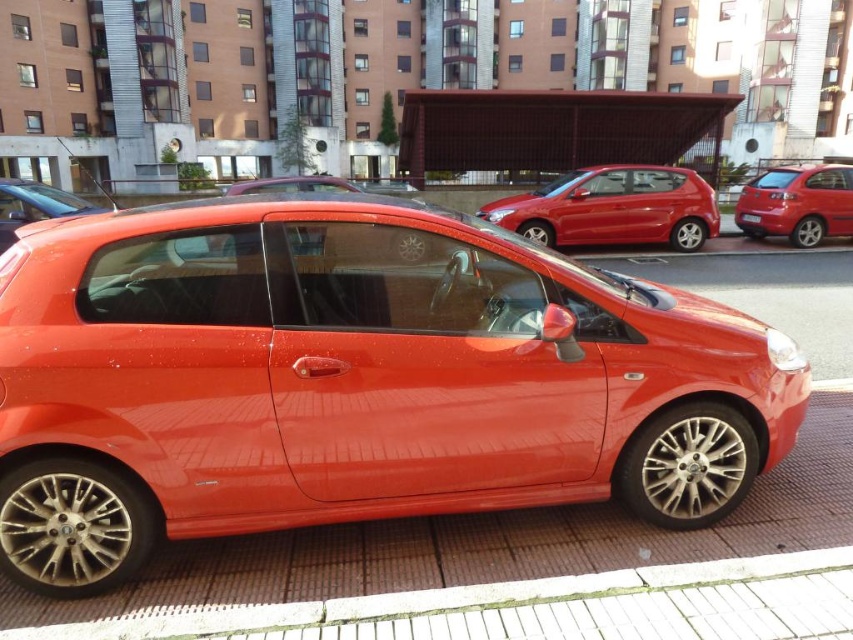
You are standing in a parking lot and see the shiny metallic car at center and the glossy red hatchback at center. Which one is positioned more to the left side?

The shiny metallic car at center is positioned to the left of the glossy red hatchback at center, so it is more to the left side.

You are a delivery driver who needs to park your van between the white brick curb at lower center and the glossy red hatchback at center. Your van is 6 meters long. Can you fit your van in the space between them?

The distance between the white brick curb at lower center and the glossy red hatchback at center is 9.41 meters. Since your van is 6 meters long, there is enough space to park it between them.

You are driving a car and need to park in the parking lot. The brick pavement at center is where you want to park. Considering the glossy red hatchback at center is already parked there, can you fit your car in the remaining space?

The brick pavement at center is wider than the glossy red hatchback at center, so there should be enough space to park your car in the remaining area.